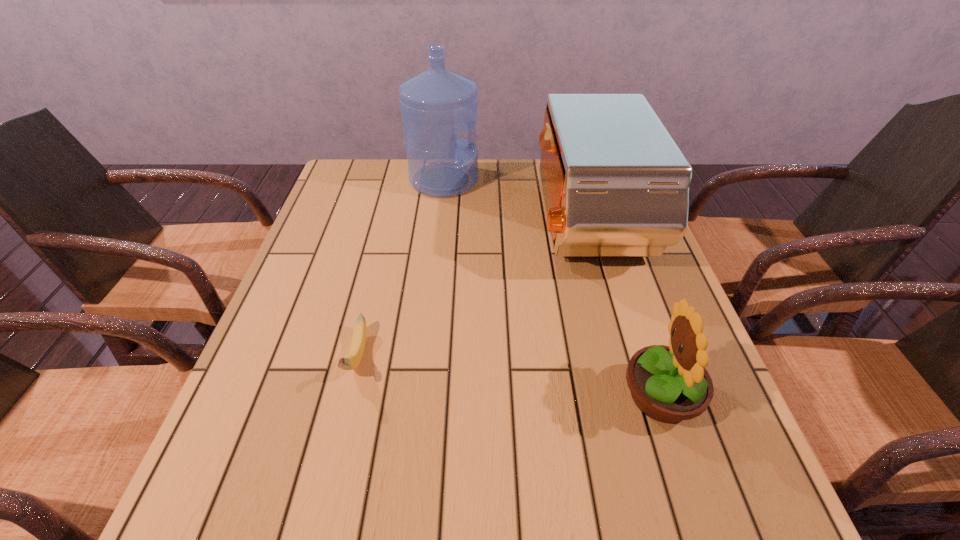
At what (x,y) coordinates should I click in order to perform the action: click on blank space that satisfies the following two spatial constraints: 1. on the door side of the second tallest object; 2. at the stem of the shortest object. Please return your answer as a coordinate pair (x, y). Looking at the image, I should click on (625, 356).

The image size is (960, 540). Identify the location of free space that satisfies the following two spatial constraints: 1. on the side of the third object from right to left with the handle; 2. at the stem of the banana. (425, 356).

Find the location of `free location that satisfies the following two spatial constraints: 1. on the door side of the toaster oven; 2. at the stem of the shortest object`. free location that satisfies the following two spatial constraints: 1. on the door side of the toaster oven; 2. at the stem of the shortest object is located at coordinates (625, 356).

Find the location of a particular element. The width and height of the screenshot is (960, 540). free space that satisfies the following two spatial constraints: 1. on the door side of the toaster oven; 2. at the stem of the leftmost object is located at coordinates (625, 356).